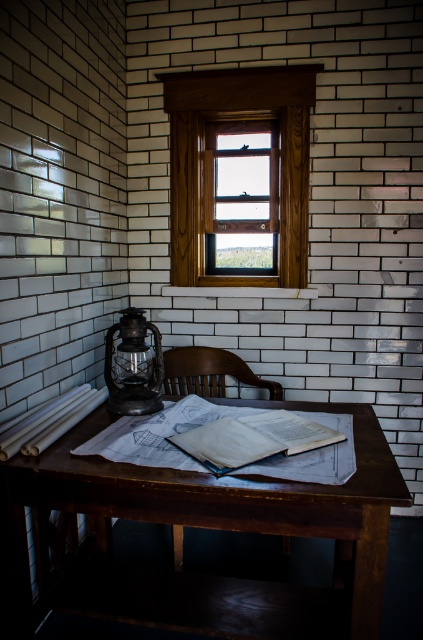
You are an interior designer planning to place a new decorative item on the table. The item requires a space wider than the matte black lantern at left. Based on the scene, is there enough space on the table next to the wooden window at center to accommodate this item?

The wooden window at center is wider than the matte black lantern at left, so there is sufficient space next to the wooden window at center to place the decorative item requiring more width than the matte black lantern at left.

You are standing in the room and want to know where the wooden window at center is located. Can you tell me its coordinates?

The wooden window at center is located at point (203, 161).

You are an interior designer standing in the room and want to place a new decorative item on the table. The wooden window at center is in your line of sight. Can you see the matte black lantern at left from your current position?

The matte black lantern at left is behind the wooden window at center, so it is blocked from view. Therefore, you cannot see the matte black lantern at left from your current position.